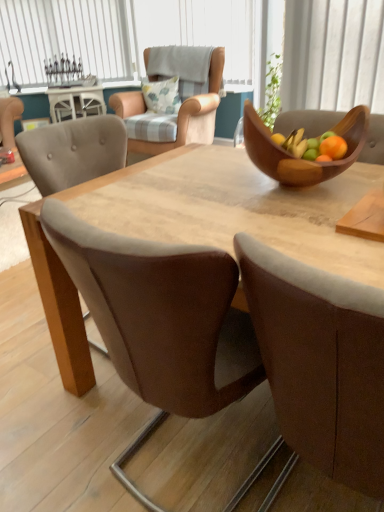
At what (x,y) coordinates should I click in order to perform the action: click on free spot above light brown wooden table at center (from a real-world perspective). Please return your answer as a coordinate pair (x, y). Image resolution: width=384 pixels, height=512 pixels. Looking at the image, I should click on (242, 198).